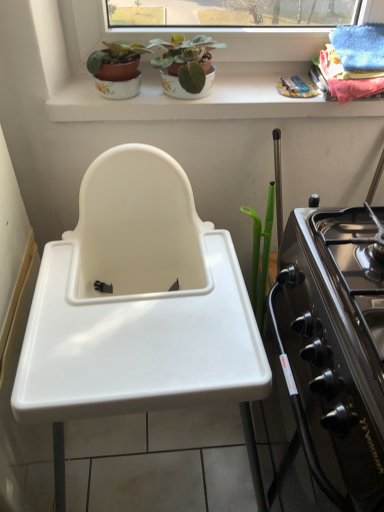
Question: Does white plastic sink at center have a lesser height compared to black glossy oven at right?

Choices:
 (A) yes
 (B) no

Answer: (B)

Question: Can you confirm if white plastic sink at center is positioned to the right of black glossy oven at right?

Choices:
 (A) no
 (B) yes

Answer: (A)

Question: Considering the relative sizes of white plastic sink at center and black glossy oven at right in the image provided, is white plastic sink at center wider than black glossy oven at right?

Choices:
 (A) yes
 (B) no

Answer: (A)

Question: Does white plastic sink at center appear on the left side of black glossy oven at right?

Choices:
 (A) yes
 (B) no

Answer: (A)

Question: Is white plastic sink at center in front of black glossy oven at right?

Choices:
 (A) no
 (B) yes

Answer: (A)

Question: From a real-world perspective, is matte ceramic pot at upper center, acting as the 1th houseplant starting from the right, physically located above or below white ceramic window sill at upper center?

Choices:
 (A) above
 (B) below

Answer: (A)

Question: Is matte ceramic pot at upper center, acting as the 1th houseplant starting from the right, inside the boundaries of white ceramic window sill at upper center, or outside?

Choices:
 (A) inside
 (B) outside

Answer: (B)

Question: From the image's perspective, is matte ceramic pot at upper center, acting as the 1th houseplant starting from the right, located above or below white ceramic window sill at upper center?

Choices:
 (A) above
 (B) below

Answer: (A)

Question: In the image, is matte ceramic pot at upper center, acting as the 1th houseplant starting from the right, positioned in front of or behind white ceramic window sill at upper center?

Choices:
 (A) front
 (B) behind

Answer: (A)

Question: In terms of size, does black glossy oven at right appear bigger or smaller than white ceramic window sill at upper center?

Choices:
 (A) small
 (B) big

Answer: (B)

Question: Considering the relative positions of black glossy oven at right and white ceramic window sill at upper center in the image provided, is black glossy oven at right to the left or to the right of white ceramic window sill at upper center?

Choices:
 (A) left
 (B) right

Answer: (B)

Question: Looking at their shapes, would you say black glossy oven at right is wider or thinner than white ceramic window sill at upper center?

Choices:
 (A) thin
 (B) wide

Answer: (B)

Question: From the image's perspective, is black glossy oven at right above or below white ceramic window sill at upper center?

Choices:
 (A) above
 (B) below

Answer: (B)

Question: From the image's perspective, is matte ceramic pot at upper center, acting as the second houseplant starting from the right, positioned above or below white plastic sink at center?

Choices:
 (A) below
 (B) above

Answer: (B)

Question: From a real-world perspective, is matte ceramic pot at upper center, acting as the second houseplant starting from the right, above or below white plastic sink at center?

Choices:
 (A) below
 (B) above

Answer: (B)